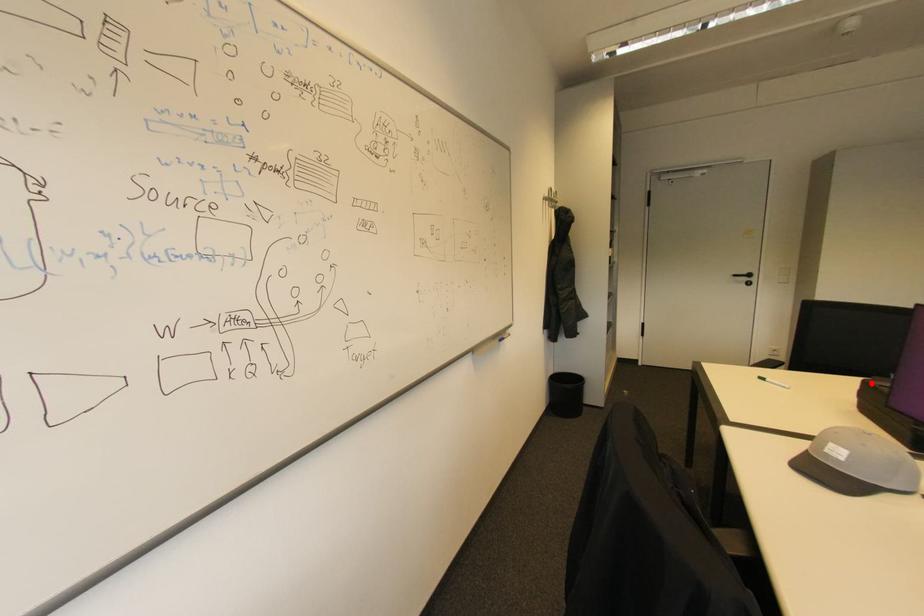
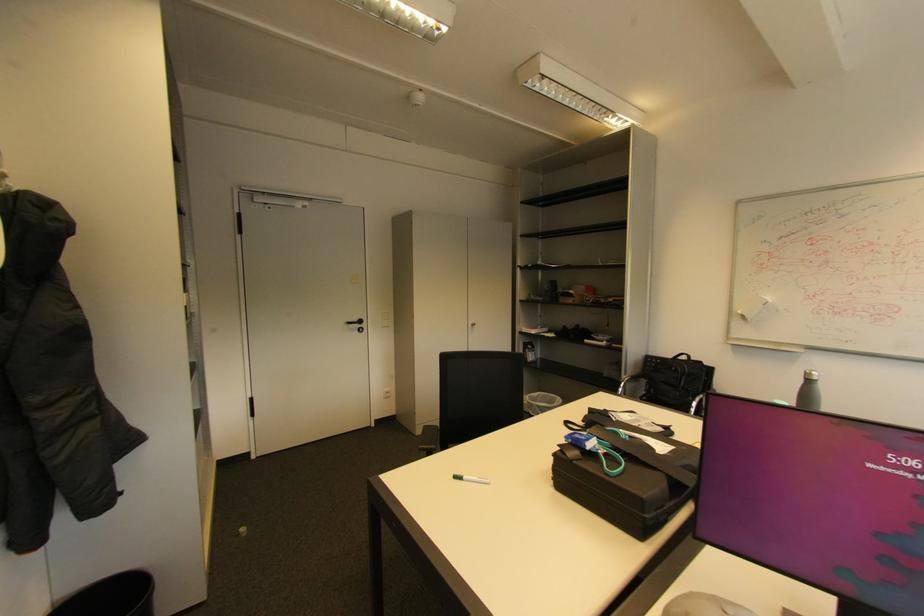
Question: I am providing you with two images of the same scene from different viewpoints. Image1 has a red point marked. In image2, the corresponding 3D location appears at what relative position? Reply with the corresponding letter.

Choices:
 (A) Closer
 (B) Farther

Answer: (A)